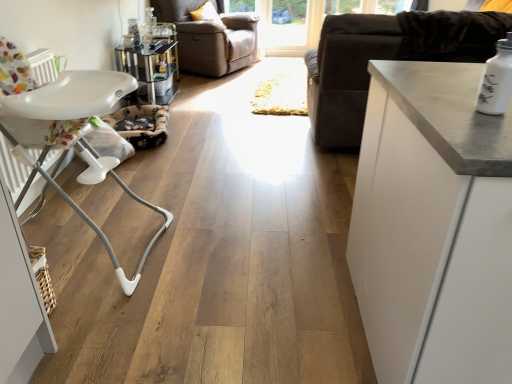
Identify the location of white plastic highchair at left. (68, 128).

Measure the distance between point (298, 16) and camera.

6.04 meters.

Where is `white matte cabinet at upper right`? The image size is (512, 384). white matte cabinet at upper right is located at coordinates (433, 227).

The image size is (512, 384). What do you see at coordinates (305, 19) in the screenshot? I see `transparent glass window at upper center, marked as the 1th window screen in a right-to-left arrangement` at bounding box center [305, 19].

Locate an element on the screen. metallic glass table at upper center is located at coordinates (150, 72).

Identify the location of white plastic highchair at left. [68, 128].

Relative to velvet dark brown couch at right, is white matte cabinet at upper right in front or behind?

Clearly, white matte cabinet at upper right is in front of velvet dark brown couch at right.

Which is behind, point (425, 261) or point (346, 113)?

Point (346, 113)

From the image's perspective, relative to velvet dark brown couch at right, is white matte cabinet at upper right above or below?

white matte cabinet at upper right is situated lower than velvet dark brown couch at right in the image.

In terms of height, does transparent glass door at upper center, the second window screen from the right, look taller or shorter compared to beige leather armchair at upper center?

transparent glass door at upper center, the second window screen from the right, is shorter than beige leather armchair at upper center.

Which object is thinner, transparent glass door at upper center, the second window screen from the right, or beige leather armchair at upper center?

transparent glass door at upper center, the second window screen from the right, is thinner.

Is transparent glass door at upper center, which is the 1th window screen in left-to-right order, to the left of beige leather armchair at upper center from the viewer's perspective?

No, transparent glass door at upper center, which is the 1th window screen in left-to-right order, is not to the left of beige leather armchair at upper center.

Which of these two, transparent glass door at upper center, which is the 1th window screen in left-to-right order, or beige leather armchair at upper center, is bigger?

beige leather armchair at upper center.

Considering the positions of points (53, 136) and (184, 8), is point (53, 136) farther from camera compared to point (184, 8)?

No, (53, 136) is closer to viewer.

Is white plastic highchair at left in front of or behind beige leather armchair at upper center in the image?

Visually, white plastic highchair at left is located in front of beige leather armchair at upper center.

Which object is positioned more to the left, white plastic highchair at left or beige leather armchair at upper center?

From the viewer's perspective, white plastic highchair at left appears more on the left side.

Does white plastic highchair at left have a lesser width compared to beige leather armchair at upper center?

Correct, the width of white plastic highchair at left is less than that of beige leather armchair at upper center.

Is velvet dark brown couch at right facing towards white matte cabinet at upper right?

No.

Is velvet dark brown couch at right to the right of white matte cabinet at upper right from the viewer's perspective?

Yes.

In terms of height, does velvet dark brown couch at right look taller or shorter compared to white matte cabinet at upper right?

Clearly, velvet dark brown couch at right is taller compared to white matte cabinet at upper right.

How different are the orientations of velvet dark brown couch at right and white matte cabinet at upper right in degrees?

velvet dark brown couch at right and white matte cabinet at upper right are facing 180 degrees away from each other.

From a real-world perspective, does white matte cabinet at upper right sit lower than transparent glass window at upper center, marked as the 1th window screen in a right-to-left arrangement?

Actually, white matte cabinet at upper right is physically above transparent glass window at upper center, marked as the 1th window screen in a right-to-left arrangement, in the real world.

From the image's perspective, is white matte cabinet at upper right on transparent glass window at upper center, which is the second window screen from left to right?

No, from the image's perspective, white matte cabinet at upper right is not on top of transparent glass window at upper center, which is the second window screen from left to right.

Which object is further away from the camera, white matte cabinet at upper right or transparent glass window at upper center, which is the second window screen from left to right?

transparent glass window at upper center, which is the second window screen from left to right, is further away from the camera.

From the image's perspective, is white matte cabinet at upper right over white plastic highchair at left?

No, from the image's perspective, white matte cabinet at upper right is not on top of white plastic highchair at left.

Is white matte cabinet at upper right wider or thinner than white plastic highchair at left?

In the image, white matte cabinet at upper right appears to be wider than white plastic highchair at left.

Is white matte cabinet at upper right inside the boundaries of white plastic highchair at left, or outside?

white matte cabinet at upper right cannot be found inside white plastic highchair at left.

Considering the relative sizes of velvet dark brown couch at right and transparent glass door at upper center, the second window screen from the right, in the image provided, is velvet dark brown couch at right bigger than transparent glass door at upper center, the second window screen from the right,?

Yes.

Who is shorter, velvet dark brown couch at right or transparent glass door at upper center, which is the 1th window screen in left-to-right order?

transparent glass door at upper center, which is the 1th window screen in left-to-right order.

From a real-world perspective, is velvet dark brown couch at right on transparent glass door at upper center, the second window screen from the right?

Indeed, from a real-world perspective, velvet dark brown couch at right stands above transparent glass door at upper center, the second window screen from the right.

From the image's perspective, does velvet dark brown couch at right appear higher than transparent glass door at upper center, which is the 1th window screen in left-to-right order?

No, from the image's perspective, velvet dark brown couch at right is not above transparent glass door at upper center, which is the 1th window screen in left-to-right order.

Where is `cabinetry located in front of the velvet dark brown couch at right`? cabinetry located in front of the velvet dark brown couch at right is located at coordinates (433, 227).

Where is `the 1st window screen directly beneath the beige leather armchair at upper center (from a real-world perspective)`? This screenshot has width=512, height=384. the 1st window screen directly beneath the beige leather armchair at upper center (from a real-world perspective) is located at coordinates (287, 24).

Considering their positions, is transparent glass window at upper center, which is the second window screen from left to right, positioned further to transparent glass door at upper center, which is the 1th window screen in left-to-right order, than white matte cabinet at upper right?

The object further to transparent glass door at upper center, which is the 1th window screen in left-to-right order, is white matte cabinet at upper right.

Estimate the real-world distances between objects in this image. Which object is closer to velvet dark brown couch at right, metallic glass table at upper center or beige leather armchair at upper center?

metallic glass table at upper center is closer to velvet dark brown couch at right.

Which object lies further to the anchor point transparent glass door at upper center, the second window screen from the right, metallic glass table at upper center or beige leather armchair at upper center?

metallic glass table at upper center is further to transparent glass door at upper center, the second window screen from the right.

Considering their positions, is white plastic highchair at left positioned closer to metallic glass table at upper center than velvet dark brown couch at right?

white plastic highchair at left.

Based on their spatial positions, is velvet dark brown couch at right or metallic glass table at upper center closer to white plastic highchair at left?

A: Among the two, velvet dark brown couch at right is located nearer to white plastic highchair at left.

Looking at the image, which one is located closer to beige leather armchair at upper center, white plastic highchair at left or metallic glass table at upper center?

Among the two, metallic glass table at upper center is located nearer to beige leather armchair at upper center.

Looking at the image, which one is located further to beige leather armchair at upper center, transparent glass door at upper center, which is the 1th window screen in left-to-right order, or white plastic highchair at left?

The object further to beige leather armchair at upper center is white plastic highchair at left.

Considering their positions, is metallic glass table at upper center positioned further to transparent glass window at upper center, which is the second window screen from left to right, than beige leather armchair at upper center?

metallic glass table at upper center is positioned further to the anchor transparent glass window at upper center, which is the second window screen from left to right.

This screenshot has height=384, width=512. I want to click on studio couch between white matte cabinet at upper right and beige leather armchair at upper center from front to back, so click(x=385, y=59).

Image resolution: width=512 pixels, height=384 pixels. I want to click on feeding chair between white matte cabinet at upper right and metallic glass table at upper center in the front-back direction, so click(x=68, y=128).

Identify the location of studio couch positioned between white matte cabinet at upper right and metallic glass table at upper center from near to far. (385, 59).

Locate an element on the screen. This screenshot has width=512, height=384. chair between white plastic highchair at left and transparent glass window at upper center, which is the second window screen from left to right, along the z-axis is located at coordinates (210, 38).